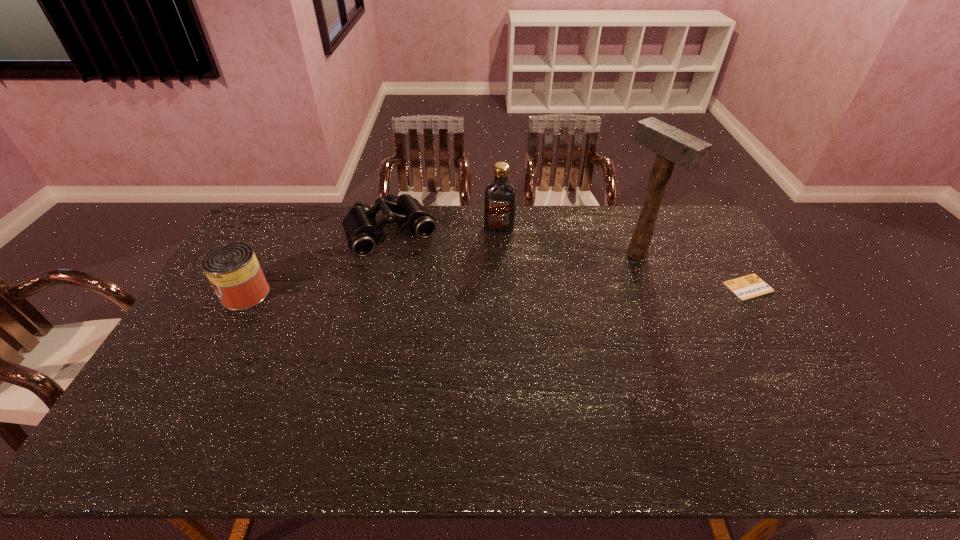
Find the location of a particular element. free space on the desktop that is between the third shortest object and the identity card and is positioned on the striking surface of the tallest object is located at coordinates (562, 290).

The height and width of the screenshot is (540, 960). In order to click on free space on the desktop that is between the third shortest object and the shortest object and is positioned on the front-facing side of the third object from right to left in this screenshot , I will do `click(487, 291)`.

Locate an element on the screen. vacant space on the desktop that is between the leftmost object and the shortest object and is positioned on the front-facing side of the binoculars is located at coordinates (427, 292).